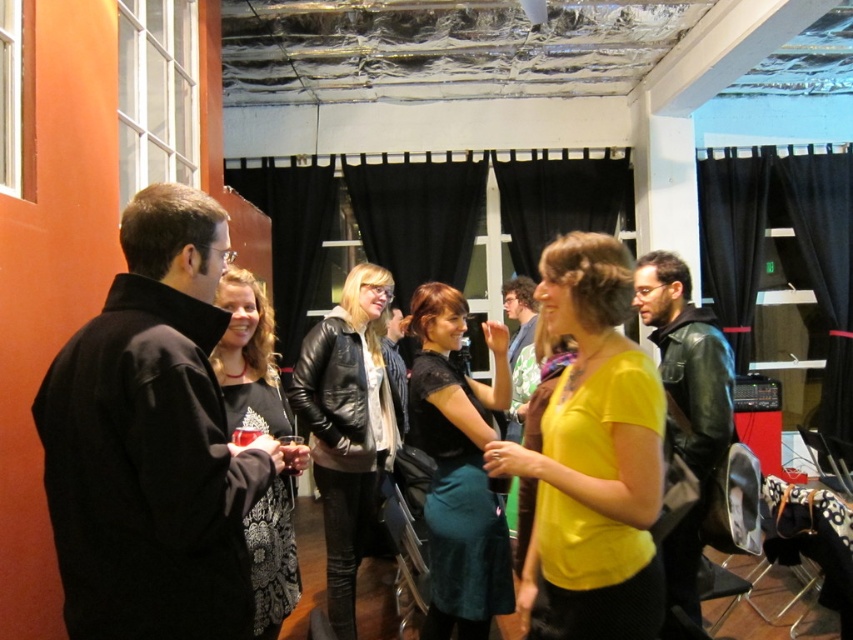
You are a photographer at this event and want to capture both the yellow matte shirt at center and the black lace dress at center in the same frame. Which one should you focus on first to ensure both are in the frame?

You should focus on the black lace dress at center first since the yellow matte shirt at center is positioned to its right, ensuring both are within the frame when centered on the dress.

You are a photographer at the event and need to position two guests wearing the black velvet dress at center and the black lace dress at center for a photo. Which dress should you place closer to the camera to ensure both are fully visible in the frame?

The black velvet dress at center is taller than the black lace dress at center, so you should place the black lace dress at center closer to the camera to ensure both are fully visible in the frame.